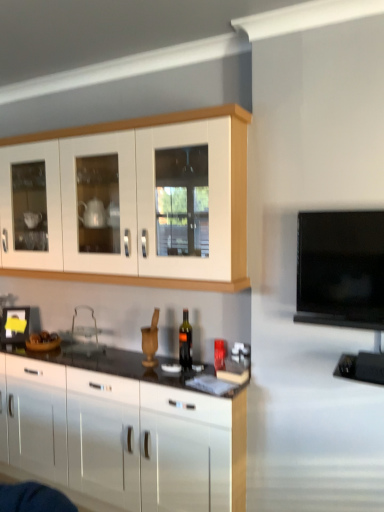
Question: Is white glossy cabinet at upper left, positioned as the 2th cabinetry in bottom-to-top order, bigger than glossy white cabinets at center, the first cabinetry ordered from the bottom?

Choices:
 (A) yes
 (B) no

Answer: (B)

Question: Does white glossy cabinet at upper left, arranged as the 1th cabinetry when viewed from the top, have a lesser width compared to glossy white cabinets at center, the first cabinetry ordered from the bottom?

Choices:
 (A) no
 (B) yes

Answer: (B)

Question: Does white glossy cabinet at upper left, positioned as the 2th cabinetry in bottom-to-top order, come in front of glossy white cabinets at center, the first cabinetry ordered from the bottom?

Choices:
 (A) yes
 (B) no

Answer: (A)

Question: Can you confirm if white glossy cabinet at upper left, positioned as the 2th cabinetry in bottom-to-top order, is positioned to the left of glossy white cabinets at center, the first cabinetry ordered from the bottom?

Choices:
 (A) no
 (B) yes

Answer: (A)

Question: Is white glossy cabinet at upper left, positioned as the 2th cabinetry in bottom-to-top order, turned away from glossy white cabinets at center, placed as the 2th cabinetry when sorted from top to bottom?

Choices:
 (A) no
 (B) yes

Answer: (A)

Question: Is white glossy cabinet at upper left, positioned as the 2th cabinetry in bottom-to-top order, shorter than glossy white cabinets at center, placed as the 2th cabinetry when sorted from top to bottom?

Choices:
 (A) yes
 (B) no

Answer: (A)

Question: Is glossy white cabinets at center, placed as the 2th cabinetry when sorted from top to bottom, directly adjacent to dark glass bottle at center?

Choices:
 (A) yes
 (B) no

Answer: (B)

Question: From the image's perspective, does glossy white cabinets at center, the first cabinetry ordered from the bottom, appear lower than dark glass bottle at center?

Choices:
 (A) no
 (B) yes

Answer: (B)

Question: Would you say glossy white cabinets at center, the first cabinetry ordered from the bottom, is outside dark glass bottle at center?

Choices:
 (A) yes
 (B) no

Answer: (A)

Question: Can you confirm if glossy white cabinets at center, placed as the 2th cabinetry when sorted from top to bottom, is thinner than dark glass bottle at center?

Choices:
 (A) no
 (B) yes

Answer: (A)

Question: Can you confirm if glossy white cabinets at center, placed as the 2th cabinetry when sorted from top to bottom, is wider than dark glass bottle at center?

Choices:
 (A) no
 (B) yes

Answer: (B)

Question: From a real-world perspective, is glossy white cabinets at center, placed as the 2th cabinetry when sorted from top to bottom, below dark glass bottle at center?

Choices:
 (A) no
 (B) yes

Answer: (B)

Question: Does white glossy cabinet at upper left, arranged as the 1th cabinetry when viewed from the top, have a lesser width compared to dark glass bottle at center?

Choices:
 (A) no
 (B) yes

Answer: (A)